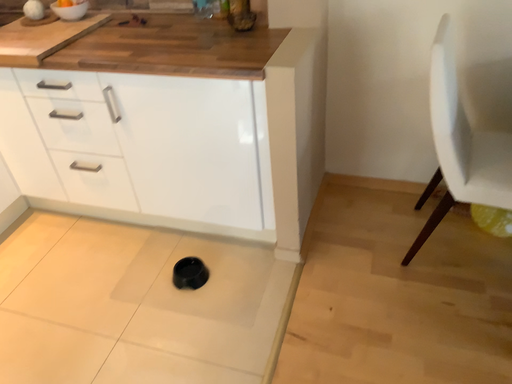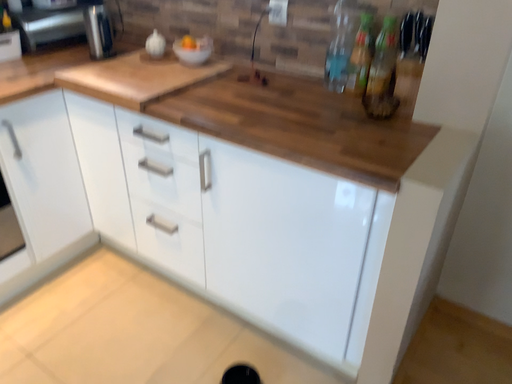
Question: Which way did the camera rotate in the video?

Choices:
 (A) rotated downward
 (B) rotated upward

Answer: (B)